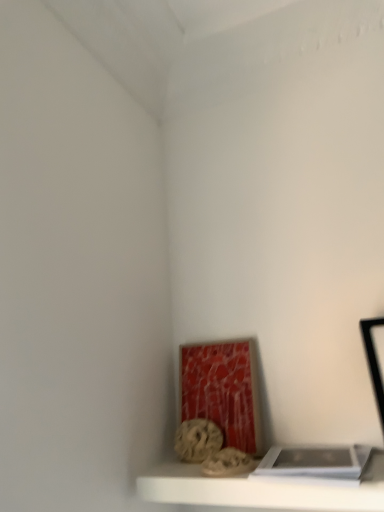
Question: Can you confirm if rustic stone sculpture at lower center is positioned to the right of white matte shelf at lower center?

Choices:
 (A) yes
 (B) no

Answer: (B)

Question: From the image's perspective, is rustic stone sculpture at lower center located beneath white matte shelf at lower center?

Choices:
 (A) no
 (B) yes

Answer: (A)

Question: Is there a large distance between rustic stone sculpture at lower center and white matte shelf at lower center?

Choices:
 (A) yes
 (B) no

Answer: (B)

Question: From a real-world perspective, is rustic stone sculpture at lower center on top of white matte shelf at lower center?

Choices:
 (A) yes
 (B) no

Answer: (A)

Question: Does rustic stone sculpture at lower center come in front of white matte shelf at lower center?

Choices:
 (A) yes
 (B) no

Answer: (B)

Question: In terms of width, does white matte book at lower right look wider or thinner when compared to white matte shelf at lower center?

Choices:
 (A) thin
 (B) wide

Answer: (A)

Question: Which is correct: white matte book at lower right is inside white matte shelf at lower center, or outside of it?

Choices:
 (A) inside
 (B) outside

Answer: (B)

Question: Does point (286, 461) appear closer or farther from the camera than point (360, 507)?

Choices:
 (A) farther
 (B) closer

Answer: (A)

Question: Visually, is white matte book at lower right positioned to the left or to the right of white matte shelf at lower center?

Choices:
 (A) right
 (B) left

Answer: (A)

Question: In terms of height, does rustic stone sculpture at lower center look taller or shorter compared to white matte shelf at lower center?

Choices:
 (A) short
 (B) tall

Answer: (B)

Question: Looking at their shapes, would you say rustic stone sculpture at lower center is wider or thinner than white matte shelf at lower center?

Choices:
 (A) wide
 (B) thin

Answer: (B)

Question: Is rustic stone sculpture at lower center to the left or to the right of white matte shelf at lower center in the image?

Choices:
 (A) left
 (B) right

Answer: (A)

Question: Do you think rustic stone sculpture at lower center is within white matte shelf at lower center, or outside of it?

Choices:
 (A) inside
 (B) outside

Answer: (B)

Question: From the image's perspective, is rustic stone sculpture at lower center above or below white matte book at lower right?

Choices:
 (A) above
 (B) below

Answer: (B)

Question: From a real-world perspective, is rustic stone sculpture at lower center above or below white matte book at lower right?

Choices:
 (A) below
 (B) above

Answer: (B)